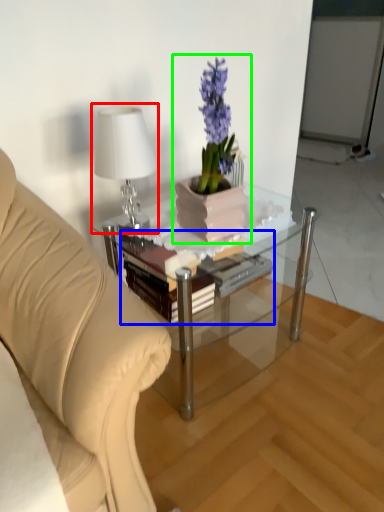
Question: Considering the real-world distances, which object is closest to table lamp (highlighted by a red box)? book (highlighted by a blue box) or houseplant (highlighted by a green box).

Choices:
 (A) book
 (B) houseplant

Answer: (B)